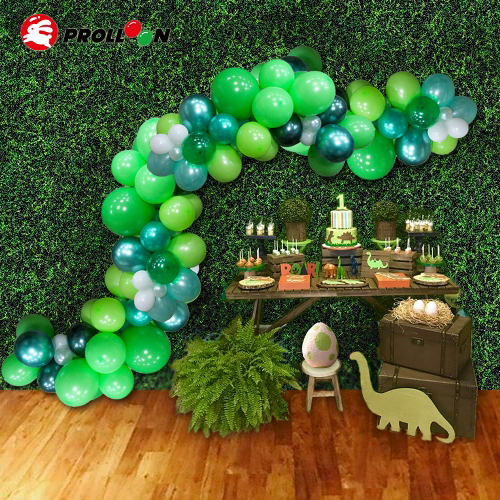
Locate an element on the screen. brown wooden floor is located at coordinates pos(299,445).